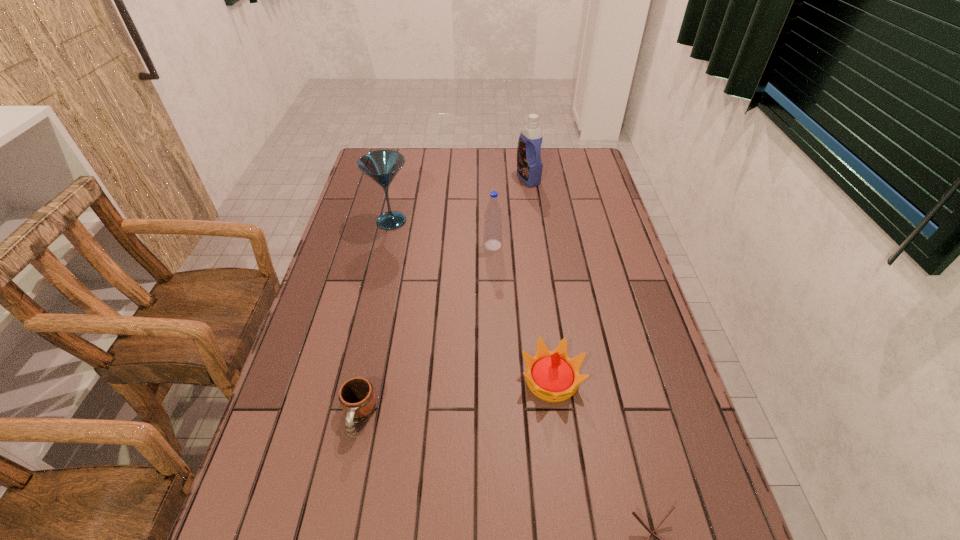
Find the location of `detergent`. detergent is located at coordinates (529, 164).

At what (x,y) coordinates should I click in order to perform the action: click on martini. Please return your answer as a coordinate pair (x, y). This screenshot has width=960, height=540. Looking at the image, I should click on (382, 166).

Where is `water bottle`? water bottle is located at coordinates (493, 215).

The height and width of the screenshot is (540, 960). Identify the location of the third object from left to right. (493, 215).

Identify the location of the fourth tallest object. The width and height of the screenshot is (960, 540). (552, 376).

Identify the location of mug. Image resolution: width=960 pixels, height=540 pixels. (357, 397).

Locate an element on the screen. vacant space located 0.340m on the left of the detergent is located at coordinates (428, 178).

At what (x,y) coordinates should I click in order to perform the action: click on free space located 0.160m on the front of the fifth nearest object. Please return your answer as a coordinate pair (x, y). This screenshot has height=540, width=960. Looking at the image, I should click on (380, 268).

Locate an element on the screen. The image size is (960, 540). vacant position located on the right of the fourth nearest object is located at coordinates (567, 245).

Where is `vacant space located on the left of the crown`? vacant space located on the left of the crown is located at coordinates (413, 380).